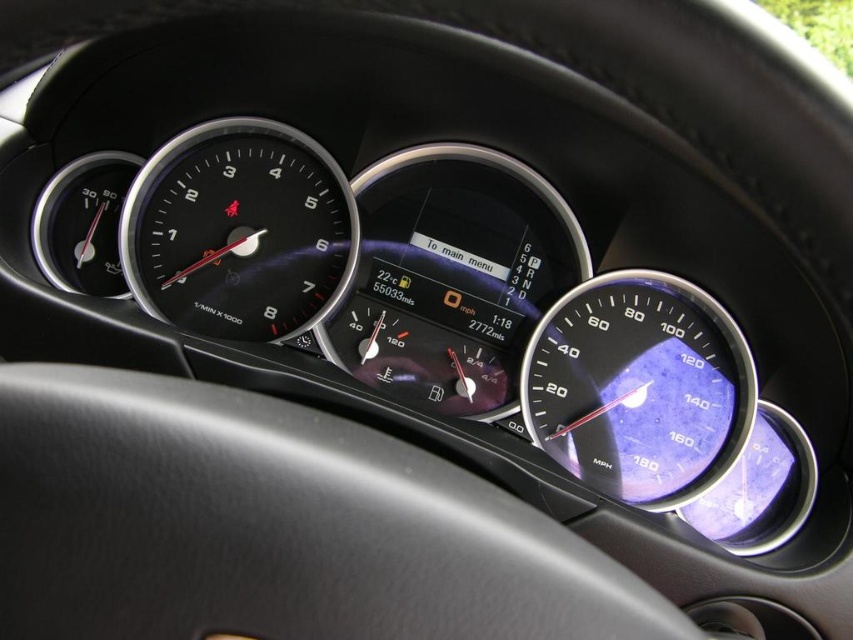
You are a driver checking the vehicle instruments. The black leather steering wheel at center has a point at coordinates (271, 525). Where is this point located on the steering wheel?

The point at coordinates (271, 525) marks the black leather steering wheel at center, so it is located at the center of the steering wheel.

You are a driver sitting in the car and want to check the speedometer. Given that your arm can comfortably reach 1.2 meters, can you comfortably reach the black glass speedometer at center from the black leather steering wheel at center?

The black leather steering wheel at center is 1.21 meters away from the black glass speedometer at center. Since your arm can reach 1.2 meters, you cannot comfortably reach the black glass speedometer at center from the black leather steering wheel at center because the distance is slightly longer than your arm can comfortably reach.

You are a mechanic inspecting the vehicle dashboard. You notice the transparent plastic speedometer at right and the black glass speedometer at center. Which one is shorter in height?

The transparent plastic speedometer at right is not as tall as the black glass speedometer at center, so the transparent plastic speedometer at right is shorter in height.